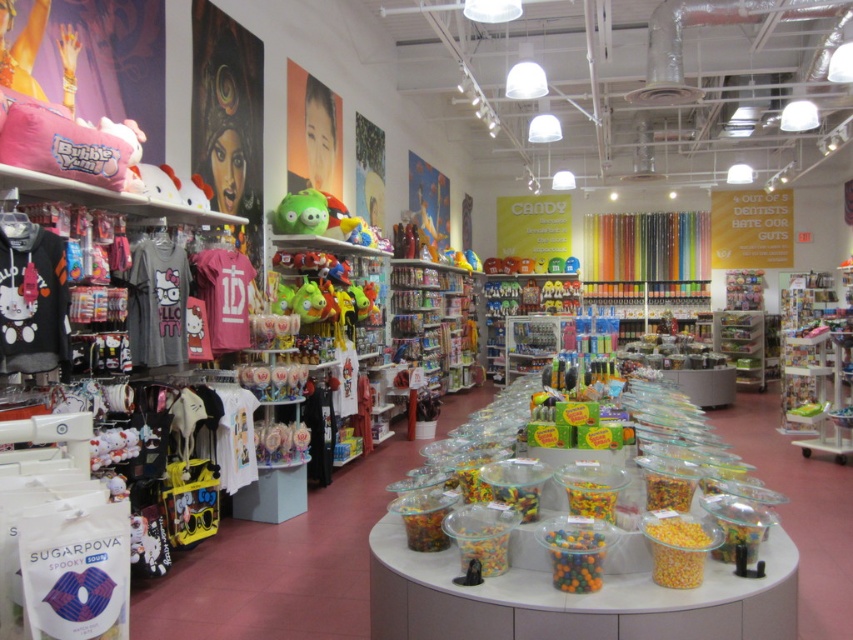
You are a customer in the store and want to place both the translucent plastic corn at center and the green rubber toy at center on a shelf that can only hold items up to the height of the taller object. Which object should you use to determine the maximum height limit?

The green rubber toy at center is taller than the translucent plastic corn at center, so the maximum height limit should be based on the green rubber toy at center.

You are a customer in the store and want to pick up both the translucent plastic corn at center and the green rubber toy at center. Which one should you reach for first if you want to grab the lower item first?

The translucent plastic corn at center is below the green rubber toy at center, so you should reach for the translucent plastic corn at center first.